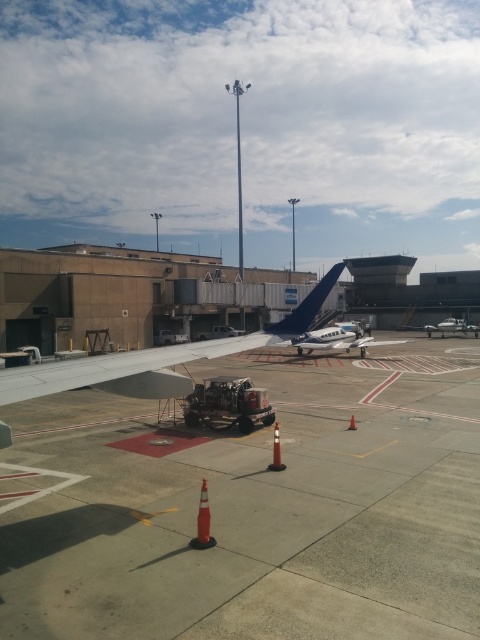
Question: Is orange reflective cone at lower center wider than orange rubber cone at center?

Choices:
 (A) no
 (B) yes

Answer: (B)

Question: Can you confirm if metallic silver airplane at center is thinner than orange matte cone at center?

Choices:
 (A) yes
 (B) no

Answer: (B)

Question: Considering the real-world distances, which object is farthest from the metallic blue airplane at center?

Choices:
 (A) blue matte airplane tail at center
 (B) orange reflective cone at lower center

Answer: (B)

Question: Which point is farther to the camera?

Choices:
 (A) orange rubber cone at center
 (B) metallic silver airplane at center
 (C) metallic blue airplane at center

Answer: (B)

Question: Does blue matte airplane tail at center have a greater width compared to metallic silver airplane at center?

Choices:
 (A) yes
 (B) no

Answer: (B)

Question: Which object is the closest to the metallic silver airplane at center?

Choices:
 (A) orange reflective cone at lower center
 (B) concrete tarmac at lower left

Answer: (B)